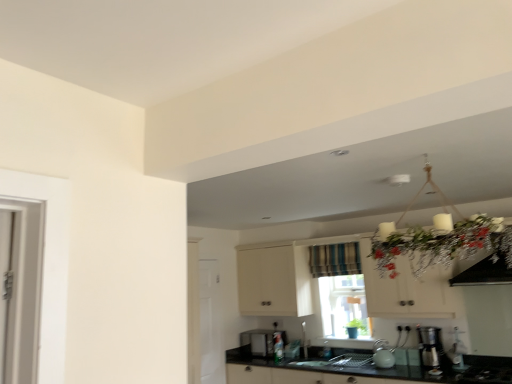
In order to face striped fabric curtain at center, should I rotate leftwards or rightwards?

To align with it, rotate right about 10.700°.

Describe the element at coordinates (486, 375) in the screenshot. I see `black glass gas stove at lower right` at that location.

You are a GUI agent. You are given a task and a screenshot of the screen. Output one action in this format:
    pyautogui.click(x=<x>, y=<y>)
    Task: Click on the satin black microwave at lower center, the second appliance from the right
    This screenshot has height=384, width=512.
    Given the screenshot: What is the action you would take?
    pyautogui.click(x=262, y=341)

What is the approximate height of satin silver coffee machine at lower right?

satin silver coffee machine at lower right is 14.35 inches tall.

At what (x,y) coordinates should I click in order to perform the action: click on striped fabric curtain at center. Please return your answer as a coordinate pair (x, y). Image resolution: width=512 pixels, height=384 pixels. Looking at the image, I should click on (334, 259).

Is black granite countertop at lower center in contact with green matte plant at lower center?

black granite countertop at lower center and green matte plant at lower center are not in contact.

Looking at this image, considering the positions of objects black granite countertop at lower center and green matte plant at lower center in the image provided, who is more to the right, black granite countertop at lower center or green matte plant at lower center?

Positioned to the right is green matte plant at lower center.

From their relative heights in the image, would you say black granite countertop at lower center is taller or shorter than green matte plant at lower center?

black granite countertop at lower center is taller than green matte plant at lower center.

Is black glass gas stove at lower right turned away from satin black microwave at lower center, which is counted as the first appliance, starting from the bottom?

No.

Locate an element on the screen. This screenshot has width=512, height=384. the 2nd appliance behind the black glass gas stove at lower right, counting from the anchor's position is located at coordinates (262, 341).

Considering the relative sizes of black glass gas stove at lower right and satin black microwave at lower center, which is the 1th appliance from back to front, in the image provided, is black glass gas stove at lower right thinner than satin black microwave at lower center, which is the 1th appliance from back to front,?

No, black glass gas stove at lower right is not thinner than satin black microwave at lower center, which is the 1th appliance from back to front.

What's the angular difference between black glass gas stove at lower right and satin black microwave at lower center, the 2th appliance from the top,'s facing directions?

black glass gas stove at lower right and satin black microwave at lower center, the 2th appliance from the top, are facing 0.119 degrees away from each other.

Does satin black microwave at lower center, the 2th appliance from the top, have a greater width compared to black granite countertop at lower center?

→ Incorrect, the width of satin black microwave at lower center, the 2th appliance from the top, does not surpass that of black granite countertop at lower center.

Looking at this image, between satin black microwave at lower center, marked as the first appliance in a left-to-right arrangement, and black granite countertop at lower center, which one has more height?

black granite countertop at lower center.

Is satin black microwave at lower center, marked as the first appliance in a left-to-right arrangement, spatially inside black granite countertop at lower center, or outside of it?

The correct answer is: inside.

Is green matte plant at lower center further to the viewer compared to white matte cabinet at upper center?

Yes, it is.

Is green matte plant at lower center smaller than white matte cabinet at upper center?

Yes.

Is green matte plant at lower center facing away from white matte cabinet at upper center?

No, white matte cabinet at upper center is not at the back of green matte plant at lower center.

Consider the image. Is green matte plant at lower center bigger than satin nickel faucet at sink center?

Incorrect, green matte plant at lower center is not larger than satin nickel faucet at sink center.

Between green matte plant at lower center and satin nickel faucet at sink center, which one appears on the left side from the viewer's perspective?

From the viewer's perspective, satin nickel faucet at sink center appears more on the left side.

From the image's perspective, is green matte plant at lower center located beneath satin nickel faucet at sink center?

No, from the image's perspective, green matte plant at lower center is not beneath satin nickel faucet at sink center.

Identify the location of faucet directly beneath the green matte plant at lower center (from a real-world perspective). (304, 340).

Considering the relative sizes of matte teal kettle at lower center, acting as the 1th appliance starting from the right, and black granite countertop at lower center in the image provided, is matte teal kettle at lower center, acting as the 1th appliance starting from the right, bigger than black granite countertop at lower center?

No.

Is matte teal kettle at lower center, acting as the second appliance starting from the back, surrounding black granite countertop at lower center?

Actually, black granite countertop at lower center is outside matte teal kettle at lower center, acting as the second appliance starting from the back.

From a real-world perspective, which is physically below, matte teal kettle at lower center, positioned as the first appliance in top-to-bottom order, or black granite countertop at lower center?

black granite countertop at lower center.

Does point (435, 347) lie behind point (465, 372)?

Yes, point (435, 347) is farther from viewer.

Which object is further away from the camera taking this photo, satin silver coffee machine at lower right or black granite countertop at lower center?

Positioned behind is satin silver coffee machine at lower right.

Would you consider satin silver coffee machine at lower right to be distant from black granite countertop at lower center?

That's not correct — satin silver coffee machine at lower right is a little close to black granite countertop at lower center.

Based on the photo, can you confirm if satin silver coffee machine at lower right is shorter than black granite countertop at lower center?

Indeed, satin silver coffee machine at lower right has a lesser height compared to black granite countertop at lower center.

Where is `countertop below the green matte plant at lower center (from a real-world perspective)`? This screenshot has height=384, width=512. countertop below the green matte plant at lower center (from a real-world perspective) is located at coordinates pyautogui.click(x=391, y=368).

Starting from the black glass gas stove at lower right, which appliance is the 2nd one behind? Please provide its 2D coordinates.

[(262, 341)]

Considering their positions, is clear glass window at center positioned further to matte teal kettle at lower center, the second appliance when ordered from bottom to top, than black granite countertop at lower center?

clear glass window at center is further to matte teal kettle at lower center, the second appliance when ordered from bottom to top.

Considering their positions, is satin black microwave at lower center, the second appliance from the right, positioned further to green matte plant at lower center than clear glass window at center?

Based on the image, satin black microwave at lower center, the second appliance from the right, appears to be further to green matte plant at lower center.

Based on their spatial positions, is white matte cabinet at upper center or satin nickel faucet at sink center closer to clear glass window at center?

Among the two, white matte cabinet at upper center is located nearer to clear glass window at center.

From the image, which object appears to be nearer to clear glass window at center, striped fabric curtain at center or satin silver coffee machine at lower right?

Based on the image, striped fabric curtain at center appears to be nearer to clear glass window at center.

Considering their positions, is satin silver coffee machine at lower right positioned closer to clear glass window at center than striped fabric curtain at center?

Based on the image, striped fabric curtain at center appears to be nearer to clear glass window at center.

Based on their spatial positions, is black granite countertop at lower center or satin silver coffee machine at lower right further from white glossy door at lower left?

satin silver coffee machine at lower right is positioned further to the anchor white glossy door at lower left.

Which object lies nearer to the anchor point green matte plant at lower center, clear glass window at center or black glass gas stove at lower right?

clear glass window at center.

When comparing their distances from black glass gas stove at lower right, does matte teal kettle at lower center, positioned as the first appliance in top-to-bottom order, or white glossy door at lower left seem further?

white glossy door at lower left is positioned further to the anchor black glass gas stove at lower right.

Locate an element on the screen. faucet between satin black microwave at lower center, which is the 1th appliance from back to front, and matte teal kettle at lower center, acting as the 1th appliance starting from the right, in the horizontal direction is located at coordinates (304, 340).

Identify the location of cabinetry between black granite countertop at lower center and satin nickel faucet at sink center from front to back. This screenshot has width=512, height=384. (276, 277).

Locate an element on the screen. The width and height of the screenshot is (512, 384). countertop between black glass gas stove at lower right and satin nickel faucet at sink center in the front-back direction is located at coordinates (391, 368).

Identify the location of countertop between white glossy door at lower left and black glass gas stove at lower right in the horizontal direction. (391, 368).